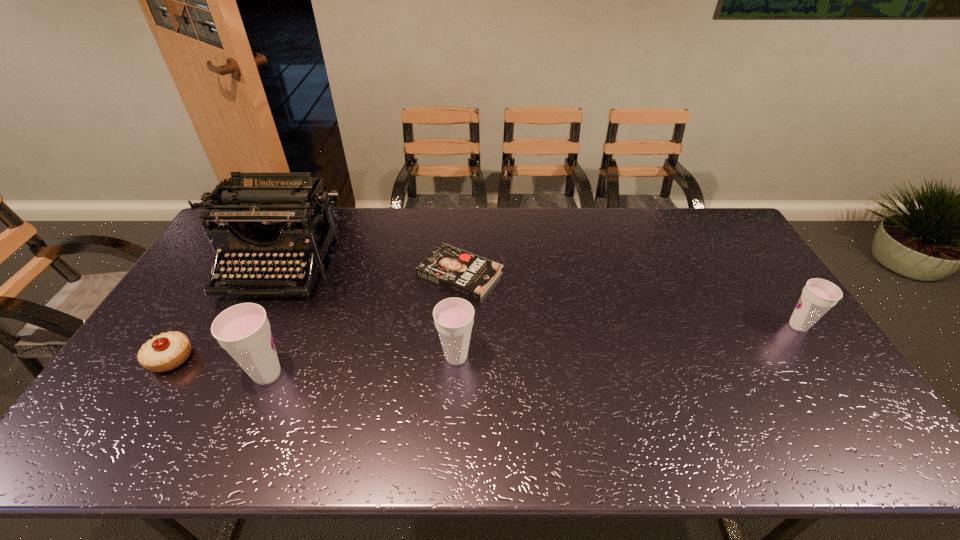
Identify the location of vacant region located 0.220m on the back of the shortest cup. This screenshot has width=960, height=540. (757, 266).

Locate an element on the screen. This screenshot has height=540, width=960. free space located 0.090m on the typing side of the typewriter is located at coordinates (249, 325).

Find the location of a particular element. vacant space positioned 0.350m on the right of the shortest object is located at coordinates (611, 275).

Where is `free point located on the right of the pastry`? free point located on the right of the pastry is located at coordinates (223, 359).

Locate an element on the screen. object that is at the far edge is located at coordinates (265, 213).

Identify the location of object at the near edge. The image size is (960, 540). (243, 330).

This screenshot has height=540, width=960. I want to click on typewriter that is at the left edge, so click(265, 213).

You are a GUI agent. You are given a task and a screenshot of the screen. Output one action in this format:
    pyautogui.click(x=<x>, y=<y>)
    Task: Click on the pastry at the left edge
    This screenshot has width=960, height=540.
    Given the screenshot: What is the action you would take?
    pyautogui.click(x=167, y=351)

At what (x,y) coordinates should I click in order to perform the action: click on object present at the right edge. Please return your answer as a coordinate pair (x, y). The width and height of the screenshot is (960, 540). Looking at the image, I should click on (818, 296).

Where is `object that is at the far left corner`? The image size is (960, 540). object that is at the far left corner is located at coordinates (265, 213).